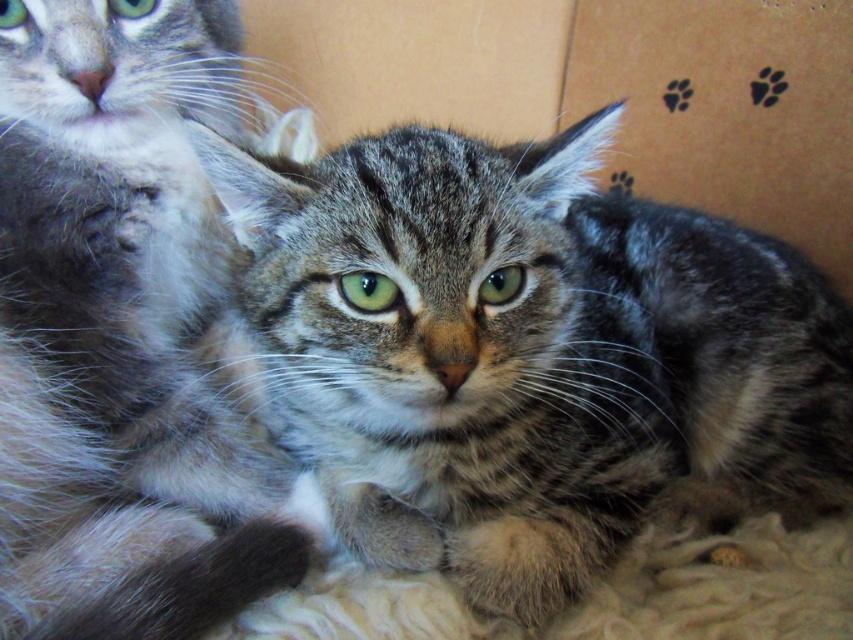
Question: Is soft gray fur cat at upper left thinner than cardboard at center?

Choices:
 (A) yes
 (B) no

Answer: (A)

Question: Which point is farther to the camera?

Choices:
 (A) tabby fur cat at center
 (B) soft gray fur cat at upper left

Answer: (A)

Question: Among these points, which one is farthest from the camera?

Choices:
 (A) (221, 499)
 (B) (708, 13)

Answer: (B)

Question: In this image, where is tabby fur cat at center located relative to cardboard at center?

Choices:
 (A) below
 (B) above

Answer: (A)

Question: Does soft gray fur cat at upper left appear on the right side of cardboard at center?

Choices:
 (A) no
 (B) yes

Answer: (A)

Question: Among these points, which one is farthest from the camera?

Choices:
 (A) pos(712,449)
 (B) pos(405,102)

Answer: (B)